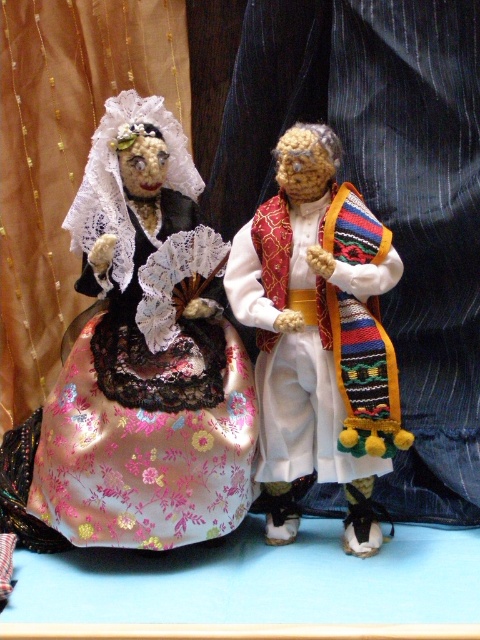
You are standing in front of two dolls displayed on a shelf. You need to reach for the silky floral dress at center and the knitted woolen doll at center. Which object will your hand touch first?

The silky floral dress at center will be touched first because it is closer to you than the knitted woolen doll at center.

You are standing in front of the dolls and want to place a small decoration between the two points marked as point (156, 227) and point (326, 378). Which point is closer to you where you should start placing the decoration?

Point (156, 227) is closer to you than point (326, 378), so you should start placing the decoration near point (156, 227).